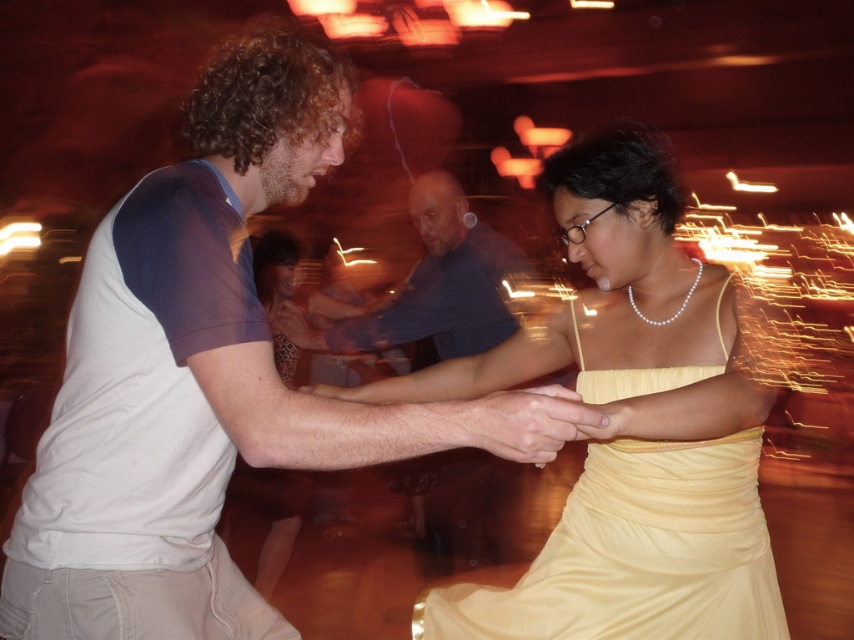
Question: Which of the following is the closest to the observer?

Choices:
 (A) smooth skin hand at center
 (B) white cotton shirt at center
 (C) yellow satin dress at center

Answer: (B)

Question: Which object appears closest to the camera in this image?

Choices:
 (A) smooth skin hand at center
 (B) white cotton shirt at center

Answer: (B)

Question: In this image, where is blue cotton shirt at center located relative to smooth skin hand at center?

Choices:
 (A) right
 (B) left

Answer: (B)

Question: Which object is farther from the camera taking this photo?

Choices:
 (A) smooth skin hand at center
 (B) yellow satin dress at center
 (C) blue cotton shirt at center
 (D) white cotton shirt at center

Answer: (C)

Question: From the image, what is the correct spatial relationship of white cotton shirt at center in relation to blue cotton shirt at center?

Choices:
 (A) below
 (B) above

Answer: (A)

Question: Is white cotton shirt at center below smooth skin hand at center?

Choices:
 (A) yes
 (B) no

Answer: (B)